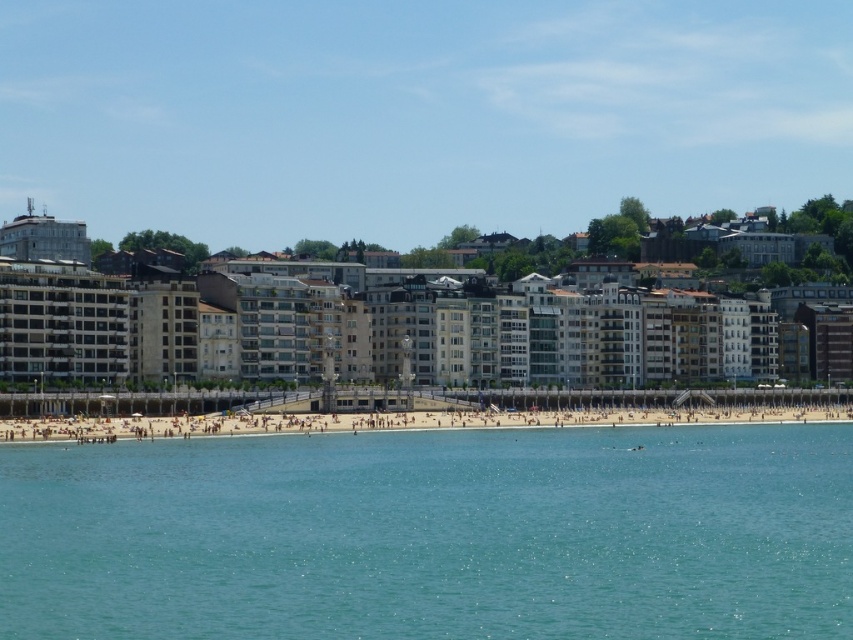
Question: Does clear blue water at beach center appear on the left side of beige stone building at center?

Choices:
 (A) yes
 (B) no

Answer: (B)

Question: Which of the following is the closest to the observer?

Choices:
 (A) beige stone building at center
 (B) light brown sand at center

Answer: (B)

Question: Does clear blue water at beach center appear under beige stone building at center?

Choices:
 (A) yes
 (B) no

Answer: (A)

Question: Which of the following is the farthest from the observer?

Choices:
 (A) clear blue water at beach center
 (B) light brown sand at center

Answer: (B)

Question: Which point is closer to the camera?

Choices:
 (A) clear blue water at beach center
 (B) beige stone building at center

Answer: (A)

Question: Is clear blue water at beach center bigger than light brown sand at center?

Choices:
 (A) yes
 (B) no

Answer: (A)